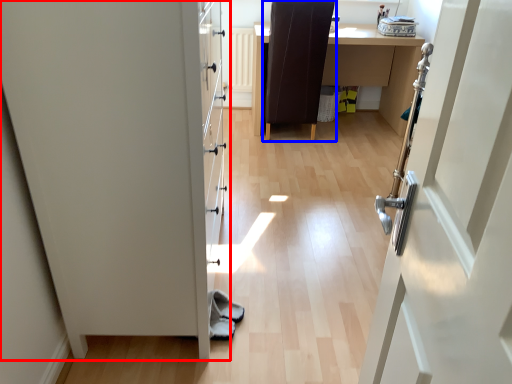
Question: Which point is further to the camera, door (highlighted by a red box) or chair (highlighted by a blue box)?

Choices:
 (A) door
 (B) chair

Answer: (B)